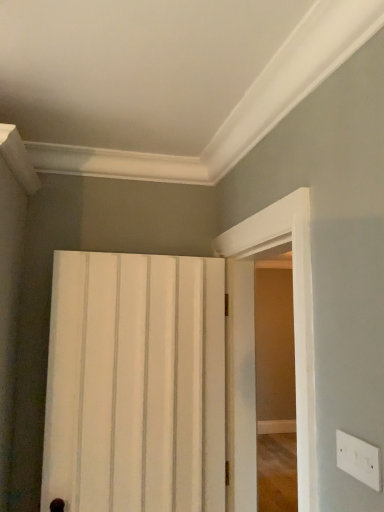
Question: Is the depth of white plastic electric outlet at lower right greater than that of white glossy door at right?

Choices:
 (A) yes
 (B) no

Answer: (B)

Question: Does white plastic electric outlet at lower right have a lesser width compared to white glossy door at right?

Choices:
 (A) no
 (B) yes

Answer: (B)

Question: Considering the relative sizes of white plastic electric outlet at lower right and white glossy door at right in the image provided, is white plastic electric outlet at lower right smaller than white glossy door at right?

Choices:
 (A) yes
 (B) no

Answer: (A)

Question: Can you confirm if white plastic electric outlet at lower right is taller than white glossy door at right?

Choices:
 (A) no
 (B) yes

Answer: (A)

Question: Is white plastic electric outlet at lower right beside white glossy door at right?

Choices:
 (A) no
 (B) yes

Answer: (A)

Question: Based on their positions, is white matte door at center located to the left or right of white glossy door at right?

Choices:
 (A) right
 (B) left

Answer: (B)

Question: Is white matte door at center spatially inside white glossy door at right, or outside of it?

Choices:
 (A) inside
 (B) outside

Answer: (B)

Question: In terms of width, does white matte door at center look wider or thinner when compared to white glossy door at right?

Choices:
 (A) wide
 (B) thin

Answer: (B)

Question: Considering the positions of white matte door at center and white glossy door at right in the image, is white matte door at center taller or shorter than white glossy door at right?

Choices:
 (A) tall
 (B) short

Answer: (B)

Question: From the image's perspective, relative to white matte door at center, is white glossy door at right above or below?

Choices:
 (A) below
 (B) above

Answer: (B)

Question: Relative to white matte door at center, is white glossy door at right in front or behind?

Choices:
 (A) behind
 (B) front

Answer: (B)

Question: From a real-world perspective, is white glossy door at right positioned above or below white matte door at center?

Choices:
 (A) below
 (B) above

Answer: (B)

Question: Considering the positions of point (231, 450) and point (210, 294), is point (231, 450) closer or farther from the camera than point (210, 294)?

Choices:
 (A) farther
 (B) closer

Answer: (B)

Question: Visually, is white matte door at center positioned to the left or to the right of white plastic electric outlet at lower right?

Choices:
 (A) right
 (B) left

Answer: (B)

Question: Relative to white plastic electric outlet at lower right, is white matte door at center in front or behind?

Choices:
 (A) behind
 (B) front

Answer: (A)